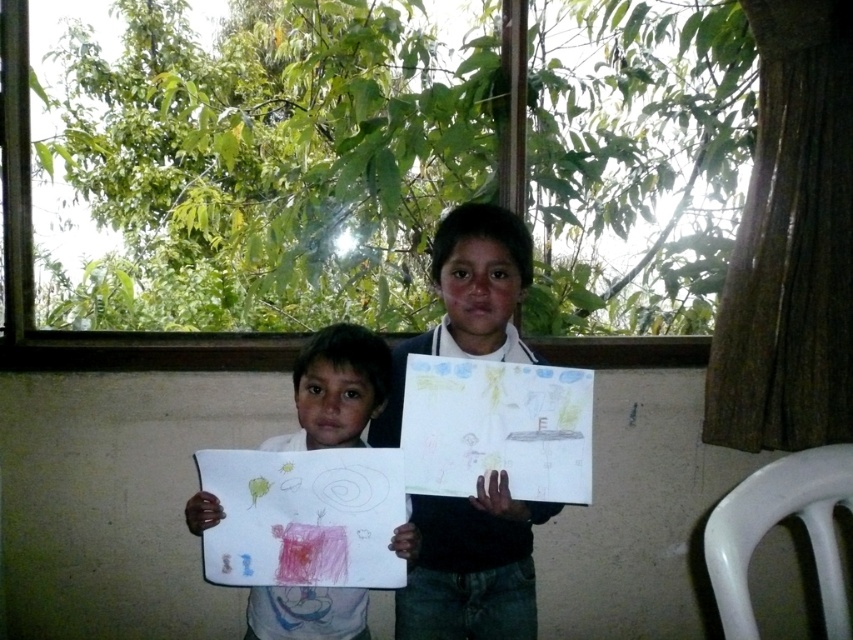
Is smooth black shirt at center taller than white paper at center?

Yes, smooth black shirt at center is taller than white paper at center.

Who is positioned more to the left, smooth black shirt at center or white paper at center?

white paper at center is more to the left.

Where is `smooth black shirt at center`? This screenshot has width=853, height=640. smooth black shirt at center is located at coordinates (473, 566).